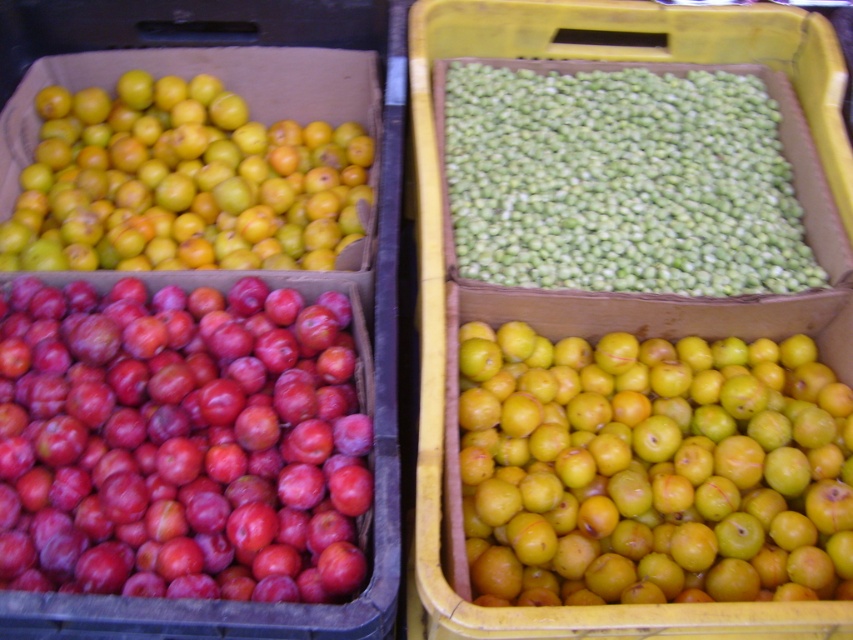
Question: Which of the following is the closest to the observer?

Choices:
 (A) yellow matte plums at upper left
 (B) yellow matte plums at center
 (C) shiny red apples at center left

Answer: (C)

Question: Which is farther from the matte cardboard box at left?

Choices:
 (A) green matte beans at center
 (B) yellow matte plums at upper left
 (C) shiny red apples at center left
 (D) yellow matte plums at center

Answer: (D)

Question: Does yellow matte plums at center appear over matte cardboard box at left?

Choices:
 (A) no
 (B) yes

Answer: (A)

Question: Considering the real-world distances, which object is farthest from the yellow matte plums at center?

Choices:
 (A) green matte beans at center
 (B) yellow matte plums at upper left
 (C) shiny red apples at center left

Answer: (B)

Question: Is shiny red apples at center left smaller than matte cardboard box at left?

Choices:
 (A) yes
 (B) no

Answer: (A)

Question: Is shiny red apples at center left wider than yellow matte plums at center?

Choices:
 (A) yes
 (B) no

Answer: (A)